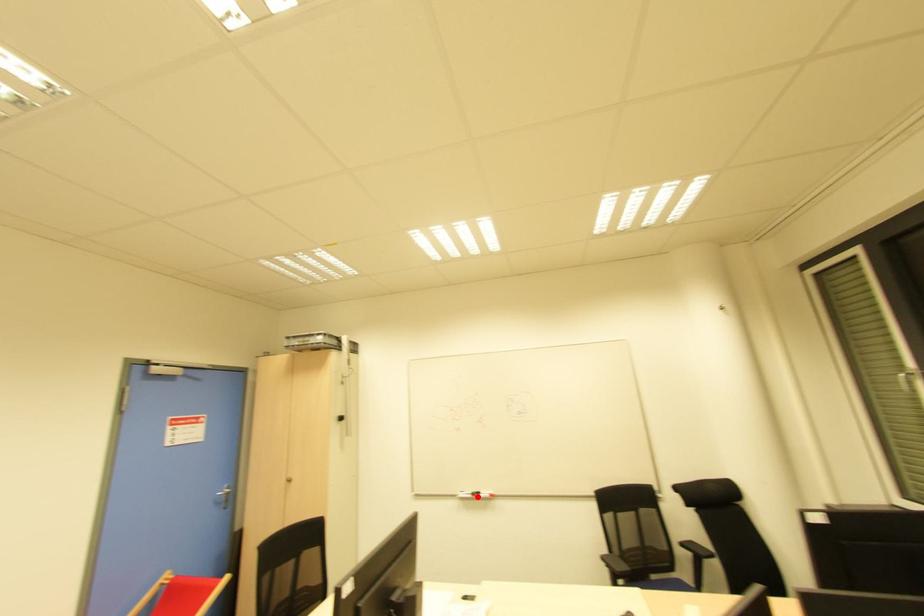
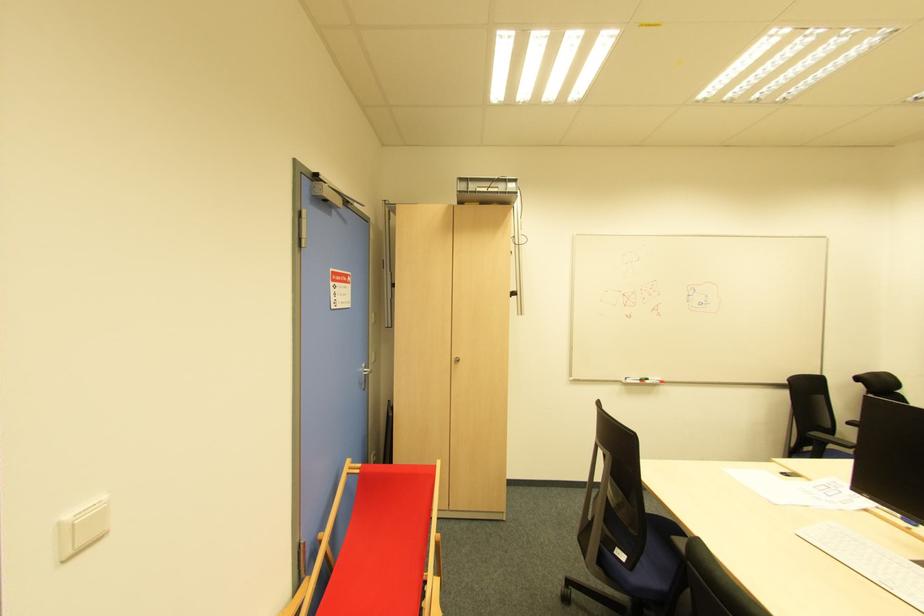
Where in the second image is the point corresponding to the highlighted location from the first image?

(647, 383)